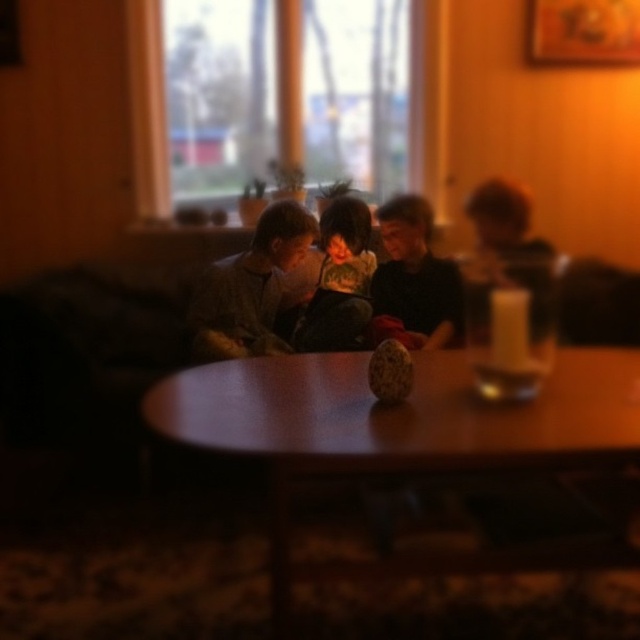
Question: Does wooden table at center appear on the right side of dark green textured sweater at center?

Choices:
 (A) no
 (B) yes

Answer: (B)

Question: Estimate the real-world distances between objects in this image. Which object is farther from the gray sweater at center?

Choices:
 (A) wooden table at center
 (B) smooth black shirt at center

Answer: (A)

Question: Based on their relative distances, which object is nearer to the wooden table at center?

Choices:
 (A) dark green textured sweater at center
 (B) smooth black shirt at center

Answer: (B)

Question: Which of the following is the closest to the observer?

Choices:
 (A) wooden table at center
 (B) gray sweater at center
 (C) smooth black shirt at center

Answer: (A)

Question: Is wooden table at center to the right of gray sweater at center from the viewer's perspective?

Choices:
 (A) no
 (B) yes

Answer: (B)

Question: Does gray sweater at center lie behind smooth black shirt at center?

Choices:
 (A) no
 (B) yes

Answer: (A)